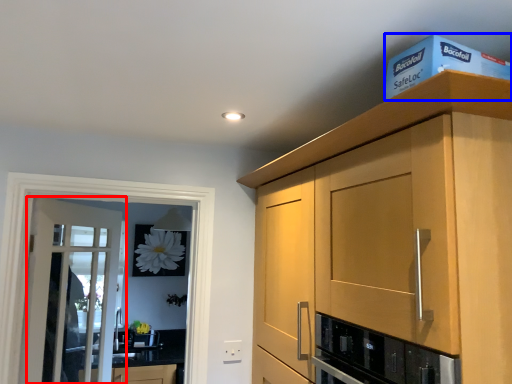
Question: Which object is closer to the camera taking this photo, door (highlighted by a red box) or box (highlighted by a blue box)?

Choices:
 (A) door
 (B) box

Answer: (B)